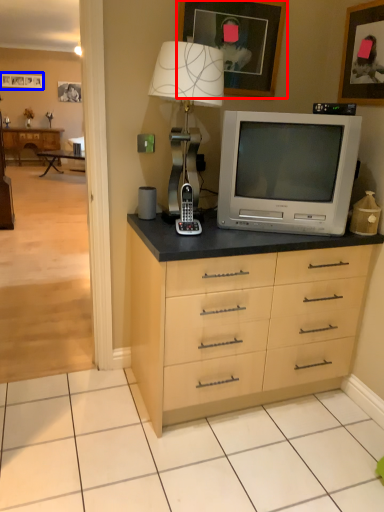
Question: Which of the following is the farthest to the observer, picture frame (highlighted by a red box) or picture frame (highlighted by a blue box)?

Choices:
 (A) picture frame
 (B) picture frame

Answer: (B)